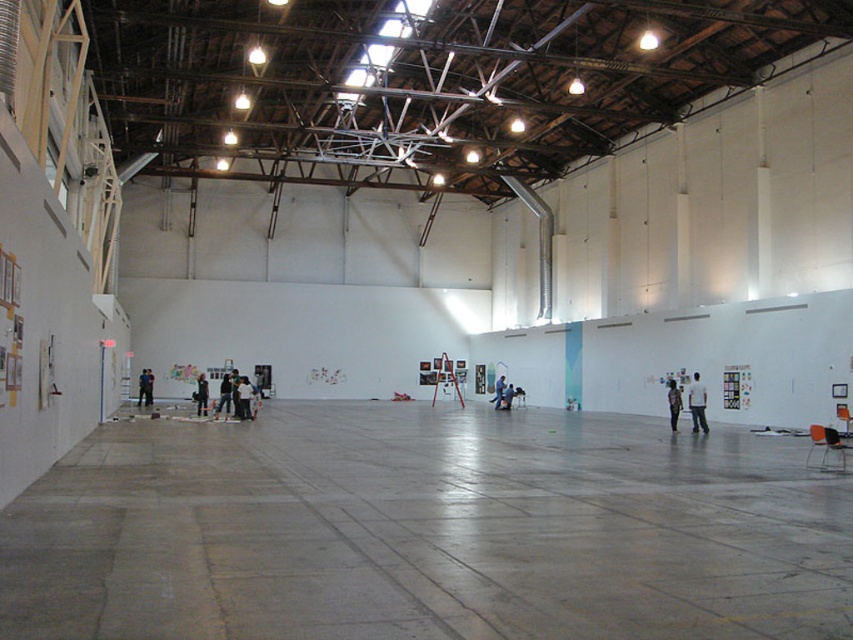
How far apart are dark gray shirt at center and dark gray jacket at center?

dark gray shirt at center is 2.93 meters from dark gray jacket at center.

Does dark gray shirt at center appear over dark gray jacket at center?

Indeed, dark gray shirt at center is positioned over dark gray jacket at center.

Describe the element at coordinates (244, 397) in the screenshot. I see `dark gray shirt at center` at that location.

The width and height of the screenshot is (853, 640). Identify the location of dark gray shirt at center. (244, 397).

Does dark gray fabric jacket at center have a lesser height compared to dark blue jeans at center?

Yes.

Which is more to the right, dark gray fabric jacket at center or dark blue jeans at center?

From the viewer's perspective, dark gray fabric jacket at center appears more on the right side.

Between point (676, 422) and point (508, 401), which one is positioned in front?

Point (676, 422)

You are a GUI agent. You are given a task and a screenshot of the screen. Output one action in this format:
    pyautogui.click(x=<x>, y=<y>)
    Task: Click on the dark gray fabric jacket at center
    This screenshot has height=640, width=853.
    Given the screenshot: What is the action you would take?
    pyautogui.click(x=672, y=403)

The image size is (853, 640). In order to click on black leather jacket at center in this screenshot , I will do `click(224, 396)`.

Is black leather jacket at center bigger than dark blue jeans at center?

Yes.

In order to click on black leather jacket at center in this screenshot , I will do `click(224, 396)`.

Find the location of `black leather jacket at center`. black leather jacket at center is located at coordinates pos(224,396).